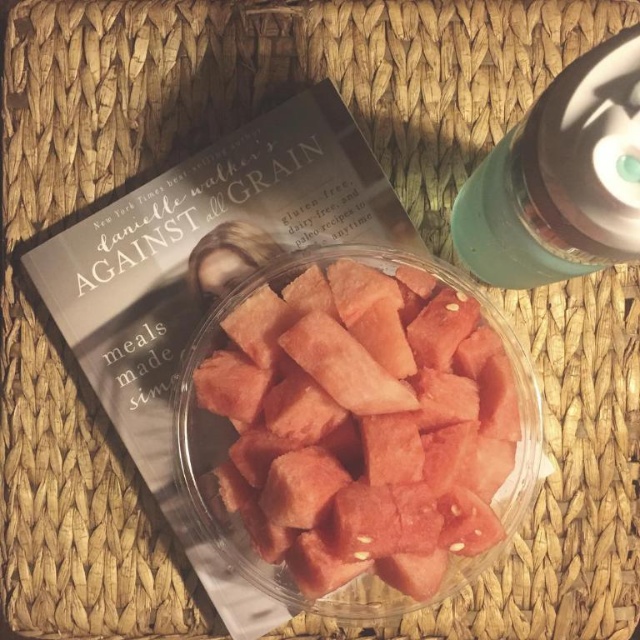
In the scene shown: Based on the scene description, where is the pink juicy watermelon at center located in terms of its 2D coordinates?

The pink juicy watermelon at center is located at the 2D coordinates of point (364, 424).

You are looking at the image and want to determine which of the two points, point (400,496) or point (474,260), is closer to you. Based on the scene, which point is nearer?

Point (400,496) is closer to the camera than point (474,260).

What object is located at the coordinates point (364, 424) in the image?

The point (364, 424) is located on the pink juicy watermelon at center.